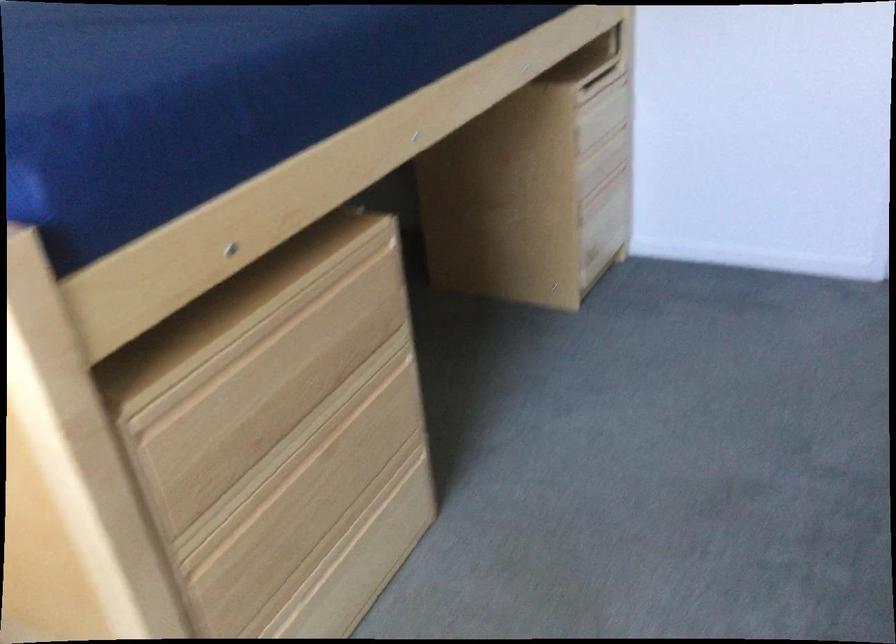
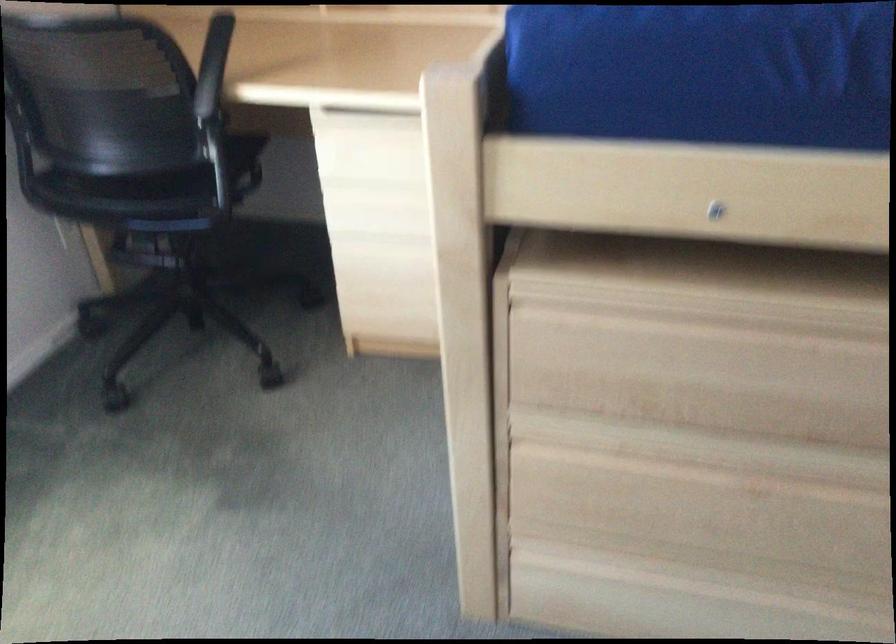
Find the pixel in the second image that matches the point at 291,442 in the first image.

(716, 451)